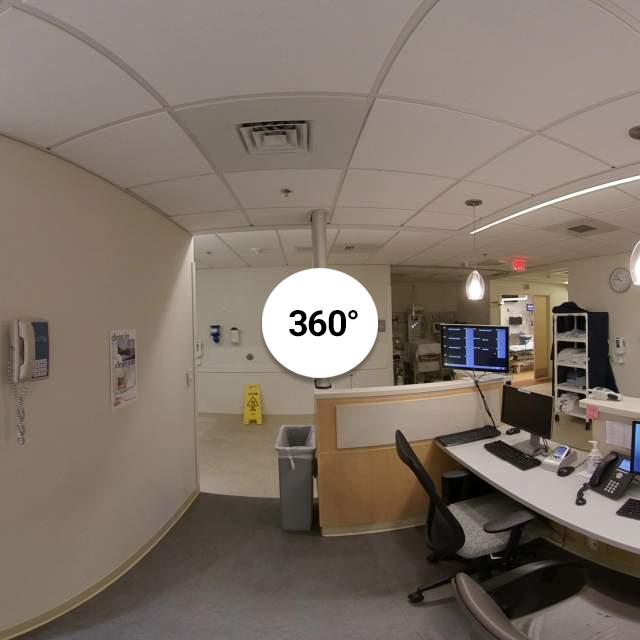
You are a GUI agent. You are given a task and a screenshot of the screen. Output one action in this format:
    pyautogui.click(x=<x>, y=<y>)
    Task: Click on the light
    
    Given the screenshot: What is the action you would take?
    pyautogui.click(x=475, y=284)